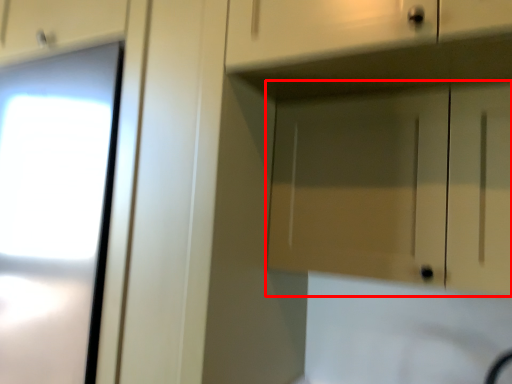
Question: In this image, where is cabinetry (annotated by the red box) located relative to drawer?

Choices:
 (A) right
 (B) left

Answer: (A)